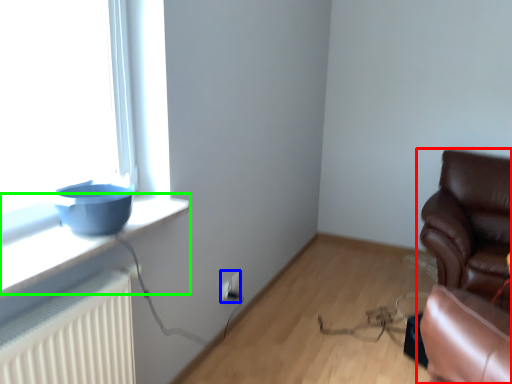
Question: Considering the real-world distances, which object is farthest from chair (highlighted by a red box)? electric outlet (highlighted by a blue box) or window sill (highlighted by a green box)?

Choices:
 (A) electric outlet
 (B) window sill

Answer: (B)